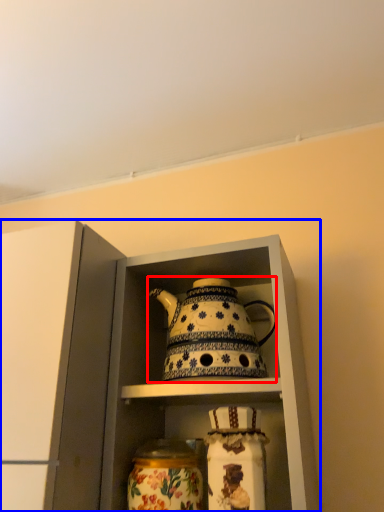
Question: Which of the following is the closest to the observer, kettle (highlighted by a red box) or cabinetry (highlighted by a blue box)?

Choices:
 (A) kettle
 (B) cabinetry

Answer: (B)